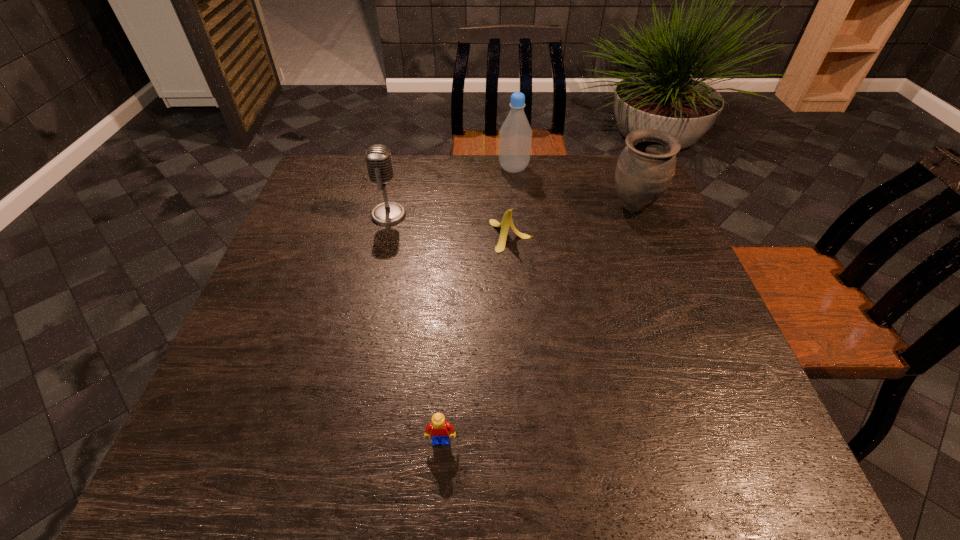
This screenshot has height=540, width=960. What are the coordinates of `vacant area situated on the front-facing side of the Lego` in the screenshot? It's located at 439,476.

I want to click on bottle that is at the far edge, so click(x=515, y=136).

The image size is (960, 540). I want to click on urn at the far edge, so click(x=646, y=166).

The width and height of the screenshot is (960, 540). In order to click on object that is at the near edge in this screenshot , I will do (439, 428).

I want to click on object present at the right edge, so click(x=646, y=166).

Where is `object present at the far right corner`? The height and width of the screenshot is (540, 960). object present at the far right corner is located at coordinates (646, 166).

What are the coordinates of `vacant space at the far edge of the desktop` in the screenshot? It's located at (492, 181).

In the image, there is a desktop. In order to click on vacant region at the left edge in this screenshot , I will do `click(299, 306)`.

The width and height of the screenshot is (960, 540). In order to click on vacant space at the right edge in this screenshot , I will do `click(665, 240)`.

In the image, there is a desktop. At what (x,y) coordinates should I click in order to perform the action: click on vacant space at the far left corner. Please return your answer as a coordinate pair (x, y). Looking at the image, I should click on (365, 180).